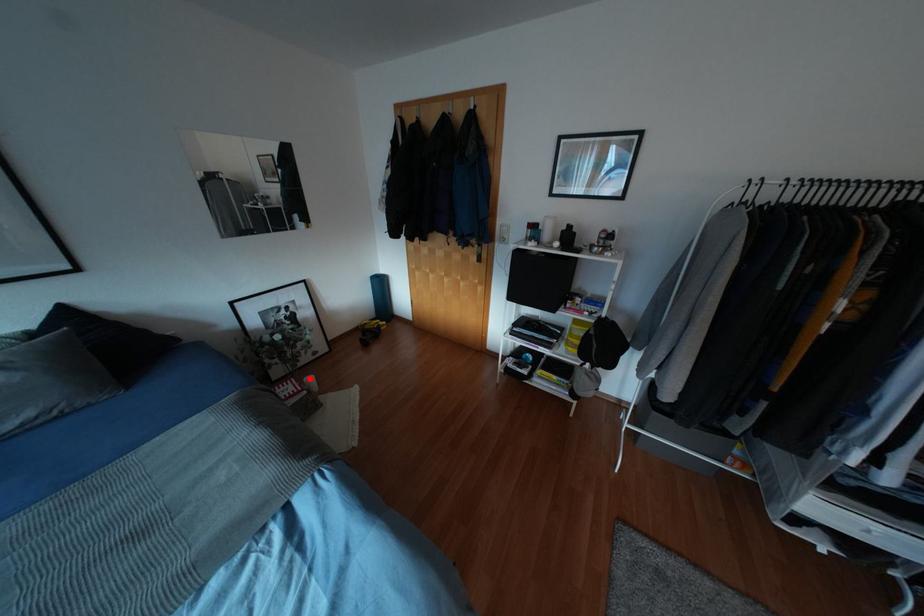
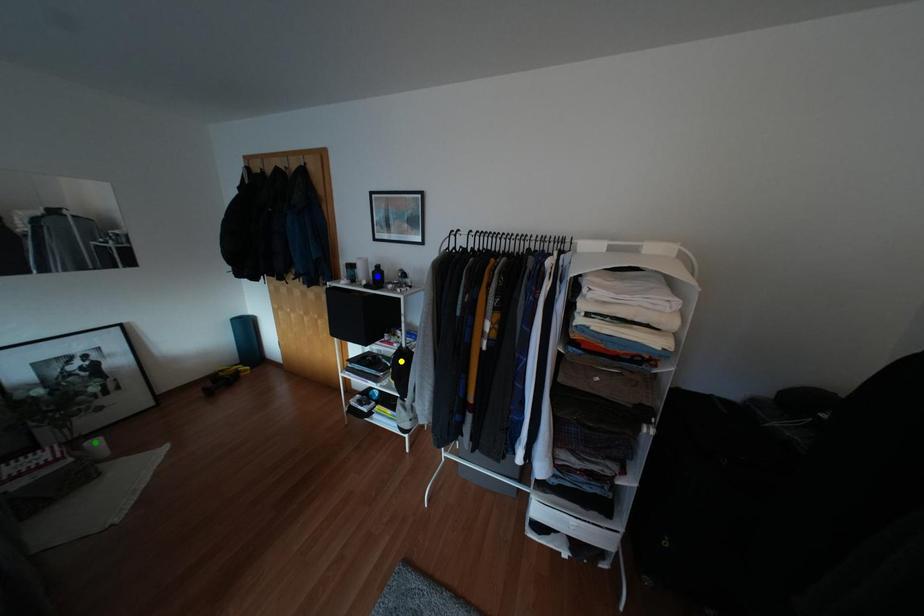
Question: I am providing you with two images of the same scene from different viewpoints. A red point is marked on the first image. You are given multiple points on the second image. Which spot in image 2 lines up with the point in image 1?

Choices:
 (A) blue point
 (B) green point
 (C) yellow point

Answer: (B)